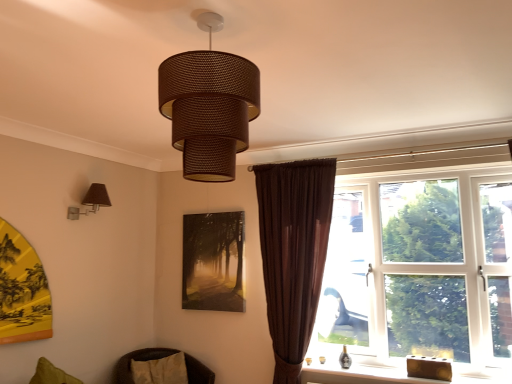
Identify the location of free space above matte black painting at center (from a real-world perspective). (209, 211).